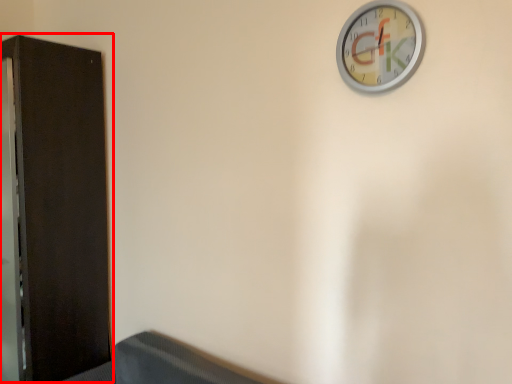
Question: From the image's perspective, considering the relative positions of dresser (annotated by the red box) and wall clock in the image provided, where is dresser (annotated by the red box) located with respect to the staircase?

Choices:
 (A) below
 (B) above

Answer: (A)